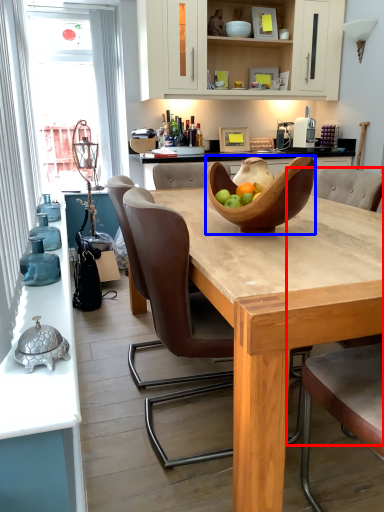
Question: Which object is further to the camera taking this photo, armchair (highlighted by a red box) or bowl (highlighted by a blue box)?

Choices:
 (A) armchair
 (B) bowl

Answer: (B)